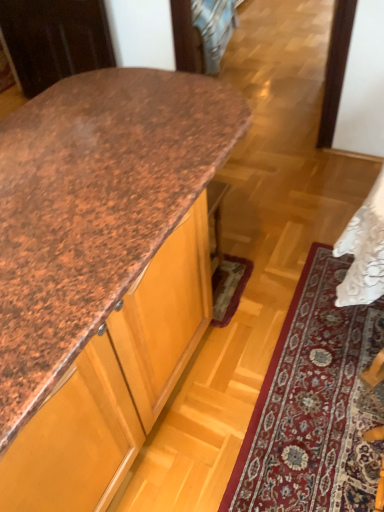
Where is `free space above carpet with intricate patterns at lower right (from a real-world perspective)`? free space above carpet with intricate patterns at lower right (from a real-world perspective) is located at coordinates pyautogui.click(x=324, y=388).